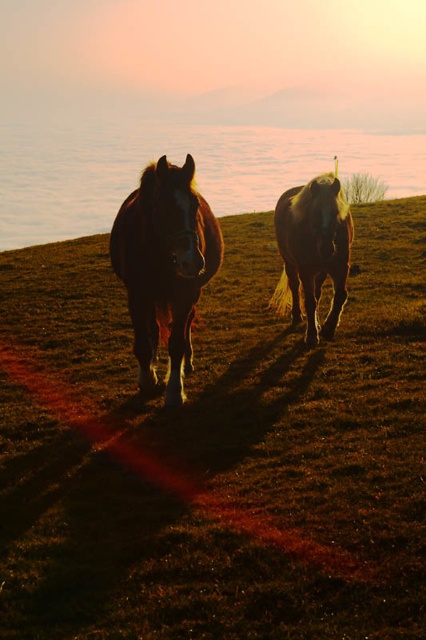
Is brown grassy at center wider than shiny brown horse at right?

Indeed, brown grassy at center has a greater width compared to shiny brown horse at right.

Does point (423, 484) come closer to viewer compared to point (299, 216)?

Yes.

The height and width of the screenshot is (640, 426). I want to click on brown grassy at center, so click(215, 451).

The height and width of the screenshot is (640, 426). What are the coordinates of `brown grassy at center` in the screenshot? It's located at (215, 451).

Does translucent glass water at center appear on the left side of shiny brown horse at center?

Correct, you'll find translucent glass water at center to the left of shiny brown horse at center.

Based on the photo, which is more to the left, translucent glass water at center or shiny brown horse at center?

From the viewer's perspective, translucent glass water at center appears more on the left side.

Which is in front, point (0, 220) or point (114, 241)?

Point (114, 241) is in front.

Locate an element on the screen. Image resolution: width=426 pixels, height=640 pixels. translucent glass water at center is located at coordinates (175, 163).

Can you confirm if shiny brown horse at center is wider than shiny brown horse at right?

Indeed, shiny brown horse at center has a greater width compared to shiny brown horse at right.

Is point (158, 220) farther from camera compared to point (278, 228)?

No, it is in front of (278, 228).

Locate an element on the screen. shiny brown horse at center is located at coordinates (164, 266).